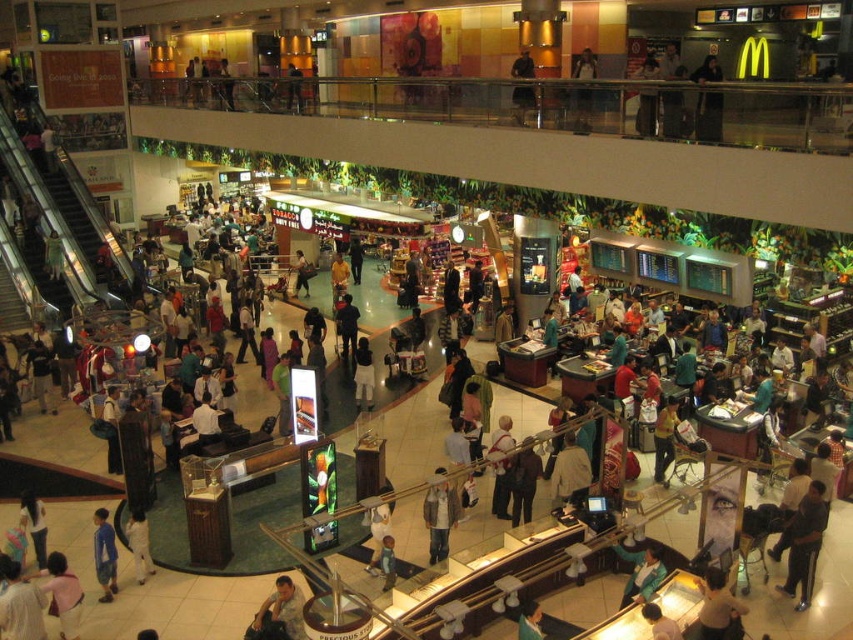
Question: Can you confirm if light brown leather jacket at lower center is smaller than yellow fabric shirt at center?

Choices:
 (A) no
 (B) yes

Answer: (B)

Question: Which point is closer to the camera taking this photo?

Choices:
 (A) (531, 637)
 (B) (306, 275)
 (C) (663, 460)
 (D) (653, 579)

Answer: (A)

Question: Can you confirm if light brown leather jacket at lower center is thinner than green fabric bag at lower center?

Choices:
 (A) no
 (B) yes

Answer: (A)

Question: Considering the real-world distances, which object is farthest from the blue cotton shirt at lower left?

Choices:
 (A) denim jacket at center
 (B) dark blue shirt at center

Answer: (B)

Question: Estimate the real-world distances between objects in this image. Which object is farther from the green fabric bag at lower center?

Choices:
 (A) light brown leather jacket at lower center
 (B) light brown leather jacket at lower right
 (C) blue cotton shirt at lower left

Answer: (C)

Question: Does green fabric jacket at lower right have a smaller size compared to green fabric bag at lower center?

Choices:
 (A) no
 (B) yes

Answer: (A)